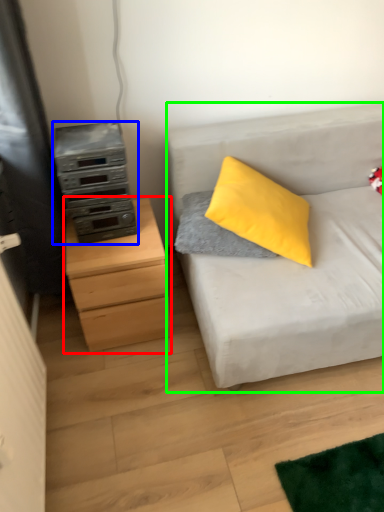
Question: Based on their relative distances, which object is nearer to chest of drawers (highlighted by a red box)? Choose from appliance (highlighted by a blue box) and studio couch (highlighted by a green box).

Choices:
 (A) appliance
 (B) studio couch

Answer: (A)